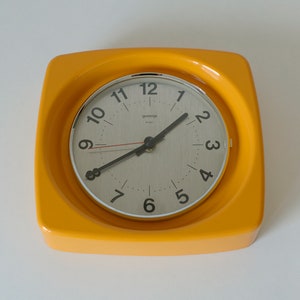
This screenshot has width=300, height=300. I want to click on wall below clock, so click(163, 274).